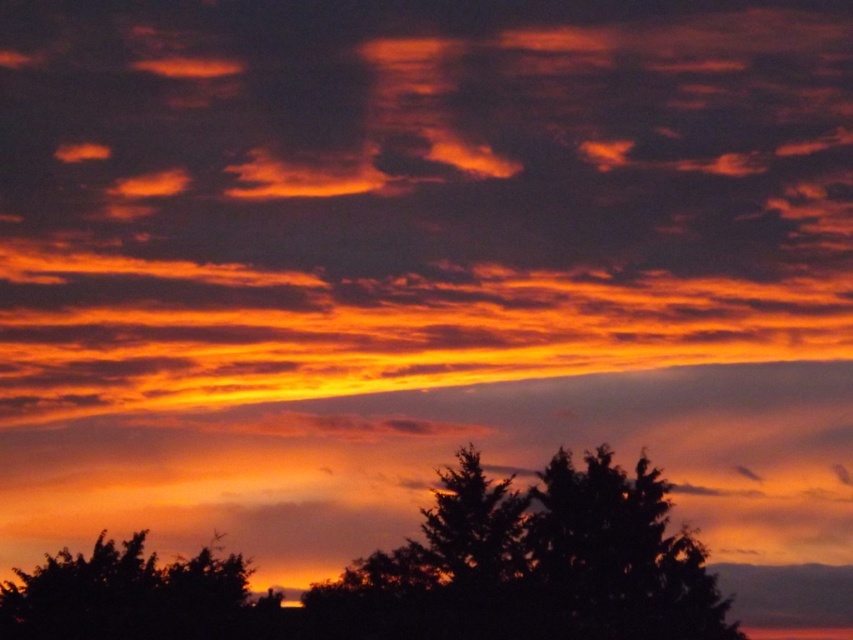
Does silhouette tree at lower center appear under silhouette tree at lower left?

Incorrect, silhouette tree at lower center is not positioned below silhouette tree at lower left.

What do you see at coordinates (418, 573) in the screenshot?
I see `silhouette tree at lower center` at bounding box center [418, 573].

Image resolution: width=853 pixels, height=640 pixels. Find the location of `silhouette tree at lower center`. silhouette tree at lower center is located at coordinates pos(418,573).